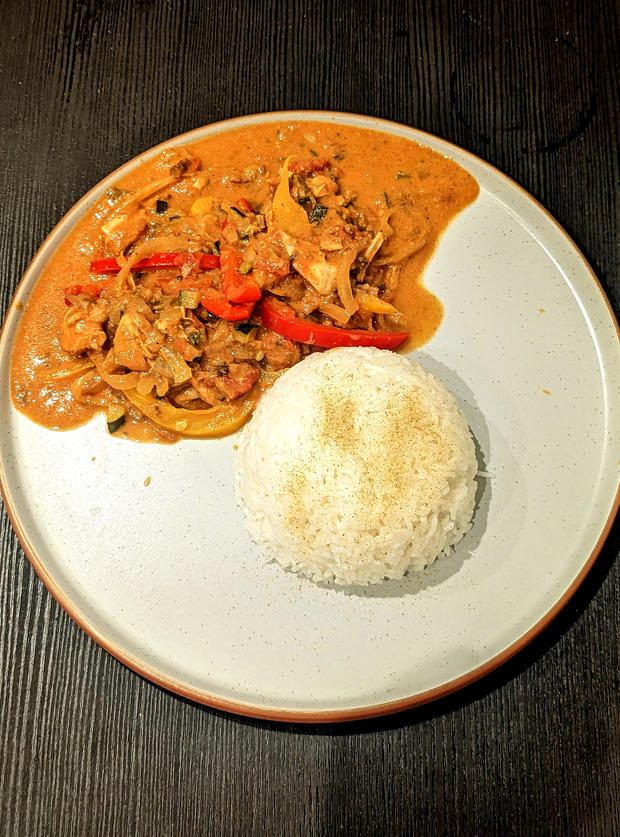
This screenshot has width=620, height=837. Identify the location of orange rim of plate. (467, 674).